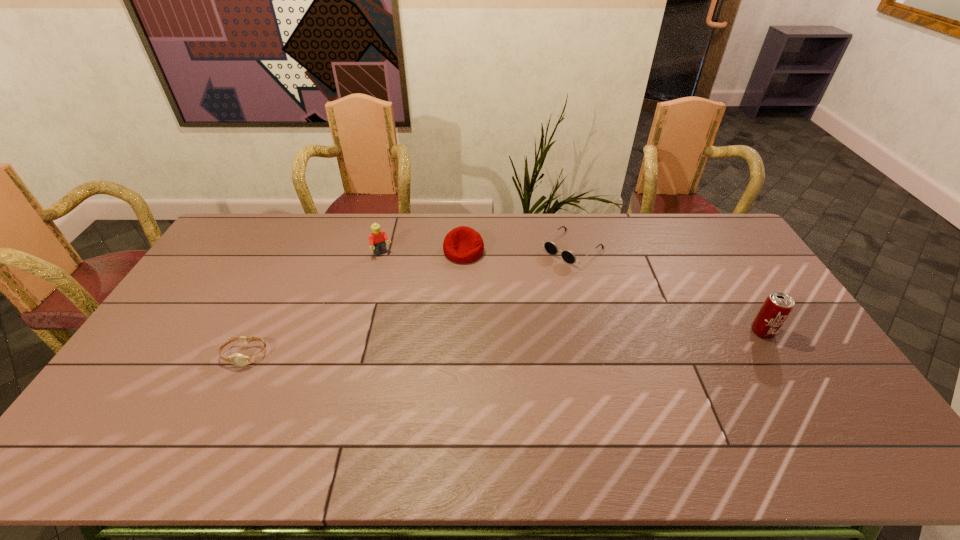
Find the location of a particular element. The height and width of the screenshot is (540, 960). free spot on the desktop that is between the nearest object and the rightmost object and is positioned on the seat area of the beanbag is located at coordinates (452, 346).

The image size is (960, 540). In order to click on vacant space on the desktop that is between the nearest object and the second nearest object and is positioned on the front-facing side of the fourth object from left to right in this screenshot , I will do `click(452, 346)`.

This screenshot has height=540, width=960. Identify the location of vacant space on the desktop that is between the leftmost object and the beer can and is positioned on the face of the Lego. (449, 346).